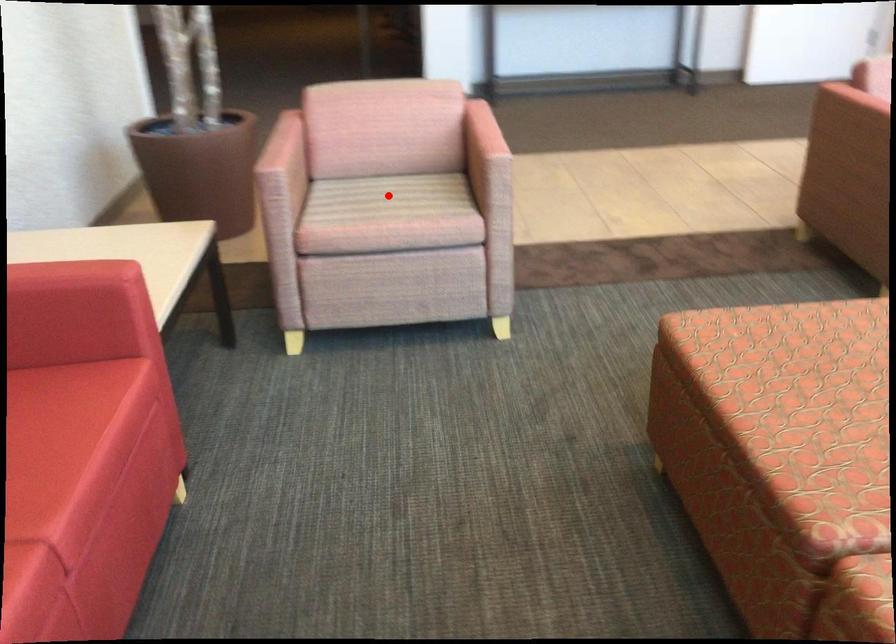
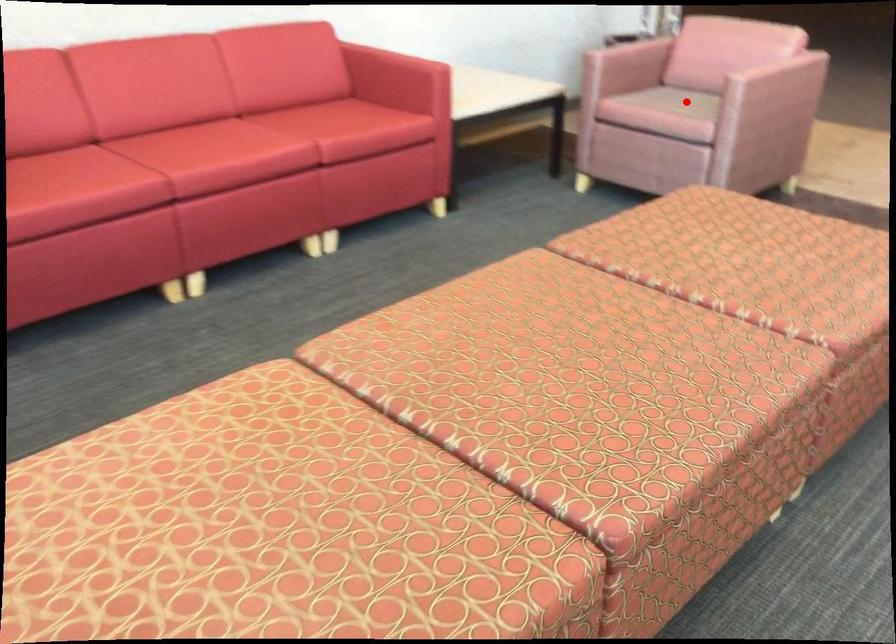
I am providing you with two images of the same scene from different viewpoints. A red point is marked on the first image and another point is marked on the second image. Are the points marked in image1 and image2 representing the same 3D position?

Yes